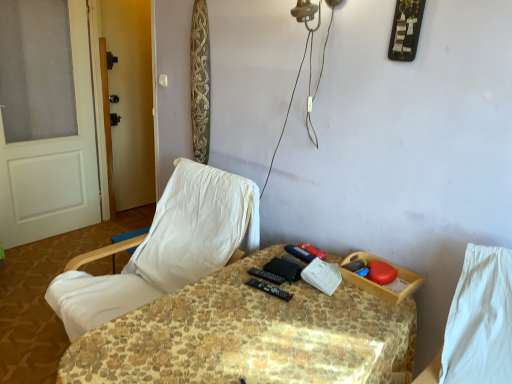
This screenshot has width=512, height=384. What are the coordinates of `free point in front of black plastic remote control at center` in the screenshot? It's located at (268, 314).